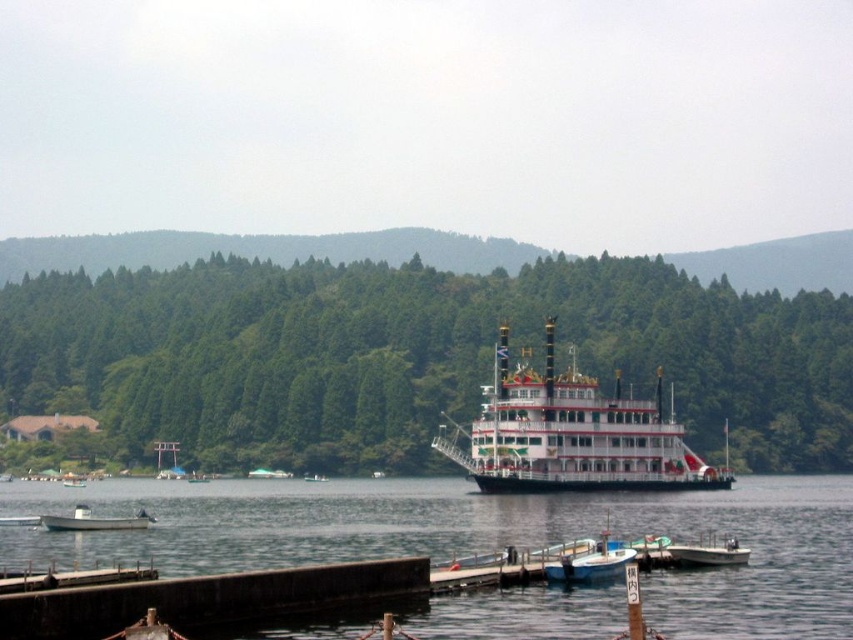
Question: Does clear water at dock center appear under green matte boat at center?

Choices:
 (A) yes
 (B) no

Answer: (B)

Question: Does dark gray concrete dock at lower left have a smaller size compared to white glossy boat at center?

Choices:
 (A) yes
 (B) no

Answer: (B)

Question: Considering the real-world distances, which object is farthest from the dark gray concrete dock at lower left?

Choices:
 (A) metallic silver boat at center
 (B) white wooden paddle steamer at center

Answer: (B)

Question: Which point appears farthest from the camera in this image?

Choices:
 (A) (138, 528)
 (B) (277, 468)

Answer: (B)

Question: Does white wooden paddle steamer at center appear over white glossy boat at center?

Choices:
 (A) no
 (B) yes

Answer: (B)

Question: Which object is the farthest from the white glossy boat at lower center?

Choices:
 (A) green matte boat at center
 (B) dark gray concrete dock at lower left

Answer: (A)